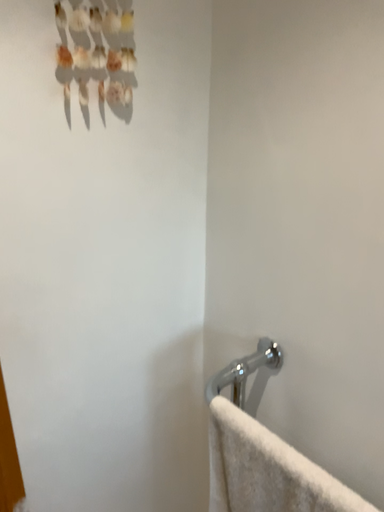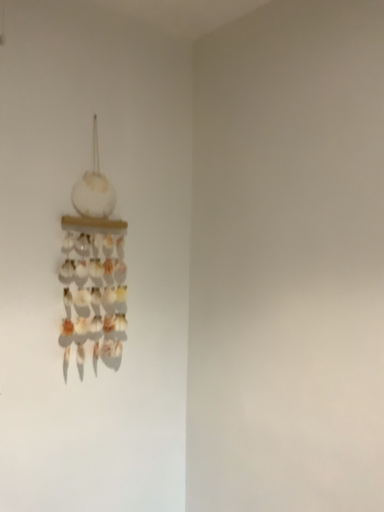
Question: How did the camera likely rotate when shooting the video?

Choices:
 (A) rotated downward
 (B) rotated upward

Answer: (B)